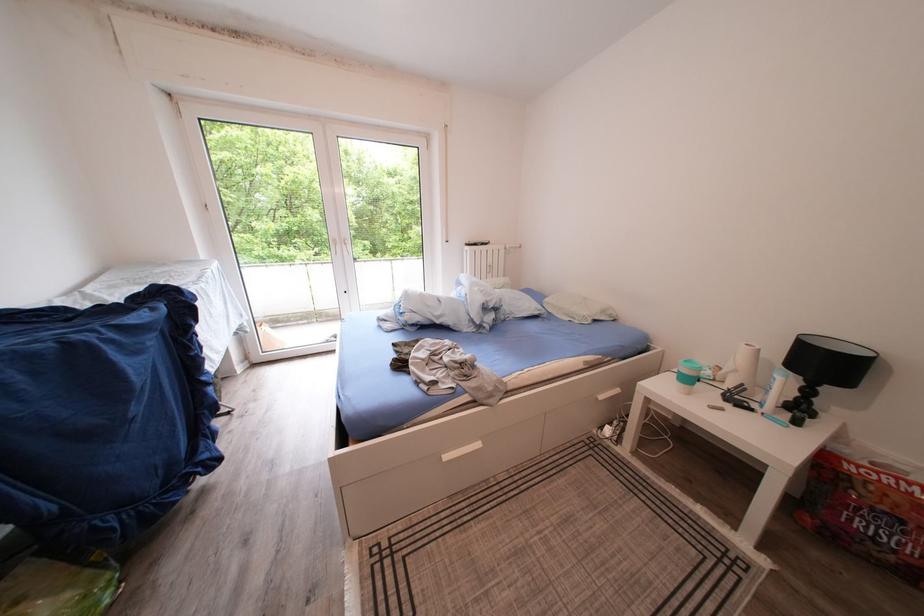
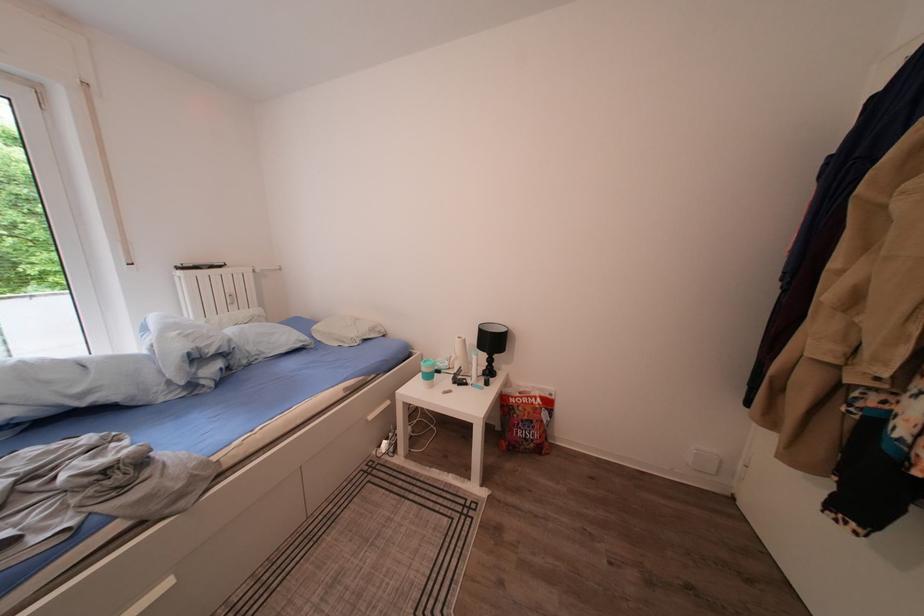
The point at [497,267] is marked in the first image. Where is the corresponding point in the second image?

(238, 296)